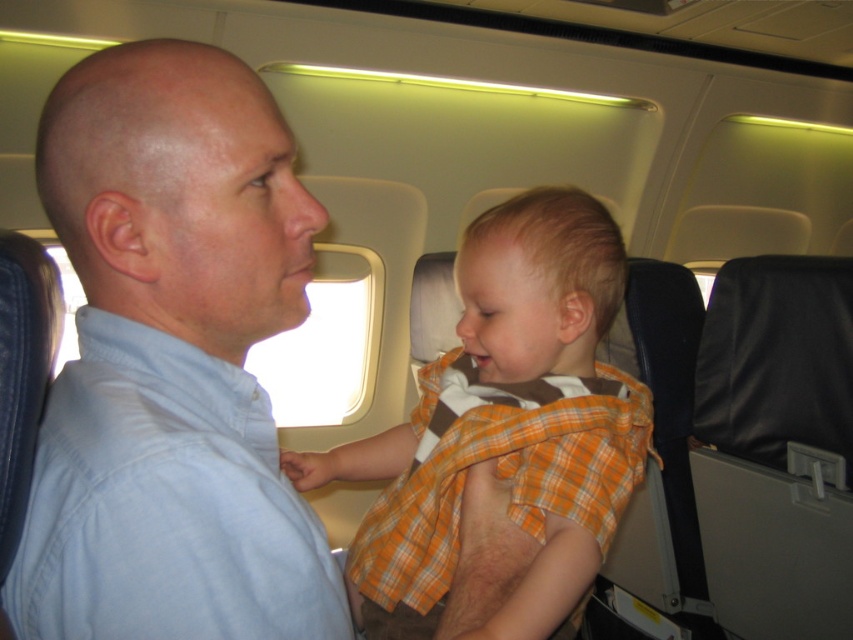
Which is below, light blue shirt at center or orange plaid shirt at center?

orange plaid shirt at center

Who is higher up, light blue shirt at center or orange plaid shirt at center?

Positioned higher is light blue shirt at center.

This screenshot has height=640, width=853. Describe the element at coordinates (171, 362) in the screenshot. I see `light blue shirt at center` at that location.

Locate an element on the screen. light blue shirt at center is located at coordinates (171, 362).